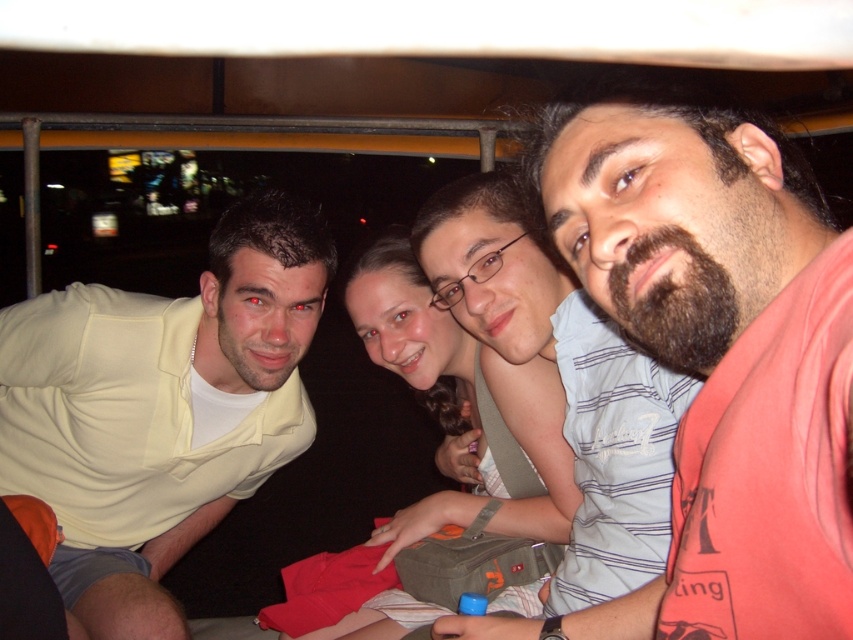
You are standing at the origin point of the coordinate system in the image. The bearded man at center is located at point 0.558, 0.839. If you want to walk directly towards him, which direction should you move?

You should move towards the point [715,356] where the bearded man at center is located.

Based on the scene description, which object might have a greater width when comparing the light yellow shirt at left and the smooth beige shirt at center?

The light yellow shirt at left might be wider than the smooth beige shirt at center according to the description.

You are standing at the center of the image and want to locate the light yellow shirt at left. Which direction should you look to find it?

The light yellow shirt at left is located at point [161,408], so you should look to the left side of the image.